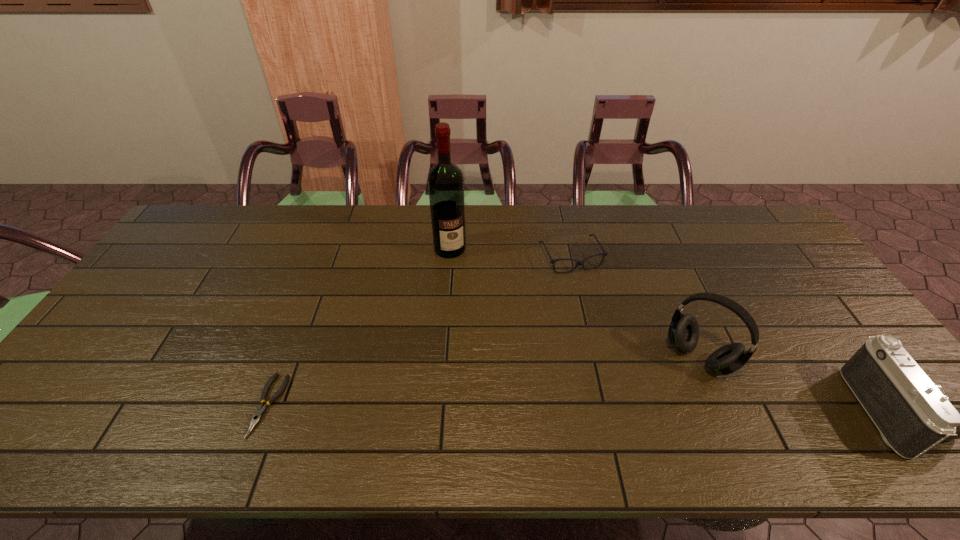
Find the location of `pliers`. pliers is located at coordinates (257, 416).

Locate an element on the screen. The width and height of the screenshot is (960, 540). the leftmost object is located at coordinates (257, 416).

This screenshot has height=540, width=960. Identify the location of the third object from right to left. (604, 253).

At what (x,y) coordinates should I click in order to perform the action: click on the second shortest object. Please return your answer as a coordinate pair (x, y). The width and height of the screenshot is (960, 540). Looking at the image, I should click on (604, 253).

Image resolution: width=960 pixels, height=540 pixels. Identify the location of headset. (683, 334).

Where is `the fourth shortest object`? The height and width of the screenshot is (540, 960). the fourth shortest object is located at coordinates (683, 334).

Locate an element on the screen. the tallest object is located at coordinates (445, 179).

The width and height of the screenshot is (960, 540). I want to click on the fourth object from right to left, so point(445,179).

The height and width of the screenshot is (540, 960). I want to click on vacant space located on the left of the shortest object, so click(x=145, y=405).

Locate an element on the screen. vacant area situated on the front-facing side of the third object from right to left is located at coordinates (589, 290).